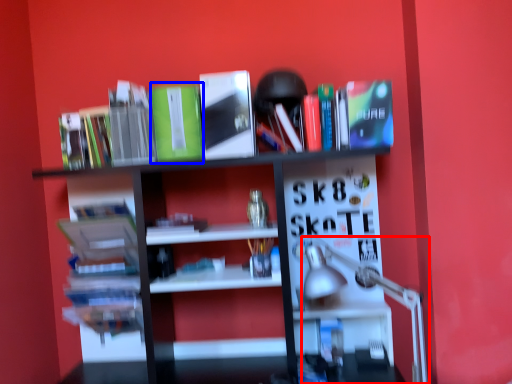
Question: Which point is closer to the camera, table lamp (highlighted by a red box) or paperback book (highlighted by a blue box)?

Choices:
 (A) table lamp
 (B) paperback book

Answer: (A)